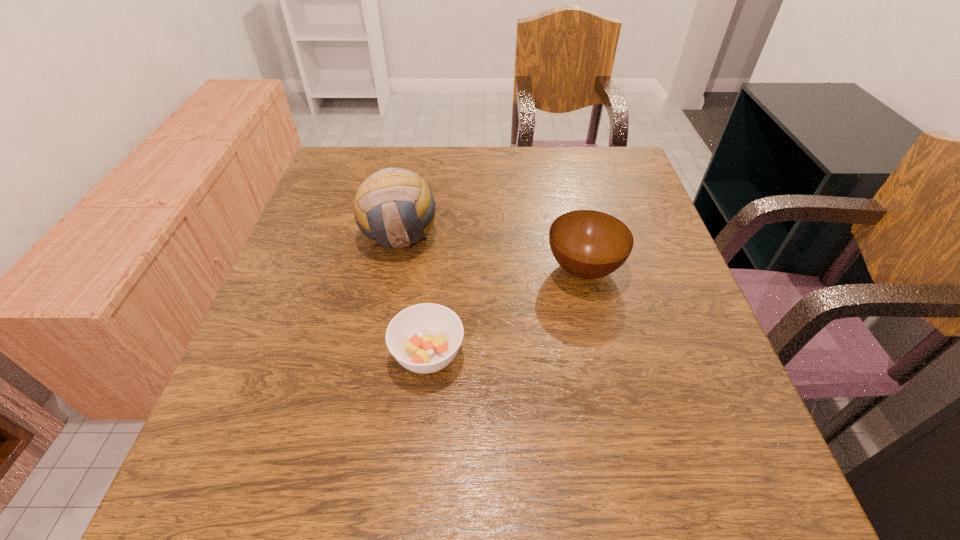
Identify the location of volleyball. (394, 207).

Identify the location of the second shortest object. (588, 244).

You are a GUI agent. You are given a task and a screenshot of the screen. Output one action in this format:
    pyautogui.click(x=<x>, y=<y>)
    Task: Click on the bowl
    The width and height of the screenshot is (960, 540).
    Given the screenshot: What is the action you would take?
    pos(588,244)

The image size is (960, 540). I want to click on the nearest object, so point(424,338).

Locate an element on the screen. The height and width of the screenshot is (540, 960). the shortest object is located at coordinates (424, 338).

Locate an element on the screen. The height and width of the screenshot is (540, 960). free space located 0.070m on the back of the tallest object is located at coordinates (407, 195).

Image resolution: width=960 pixels, height=540 pixels. In order to click on vacant space located 0.200m on the front of the second tallest object in this screenshot , I will do `click(611, 384)`.

Where is `vacant space situated on the left of the nearest object`? The width and height of the screenshot is (960, 540). vacant space situated on the left of the nearest object is located at coordinates (281, 354).

Locate an element on the screen. The width and height of the screenshot is (960, 540). object at the left edge is located at coordinates (394, 207).

Where is `object that is at the right edge`? object that is at the right edge is located at coordinates (588, 244).